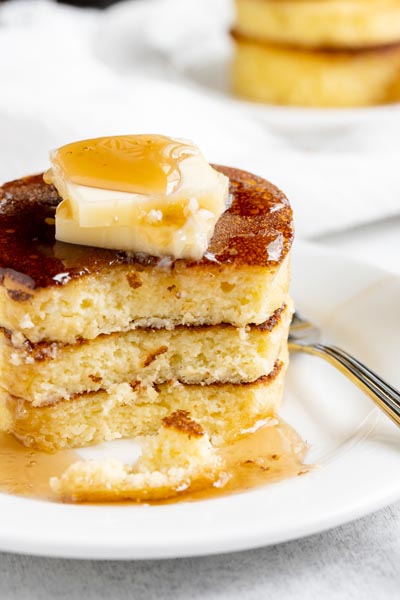
Find the location of a particular element. surface the dishes are sitting on is located at coordinates (374, 243).